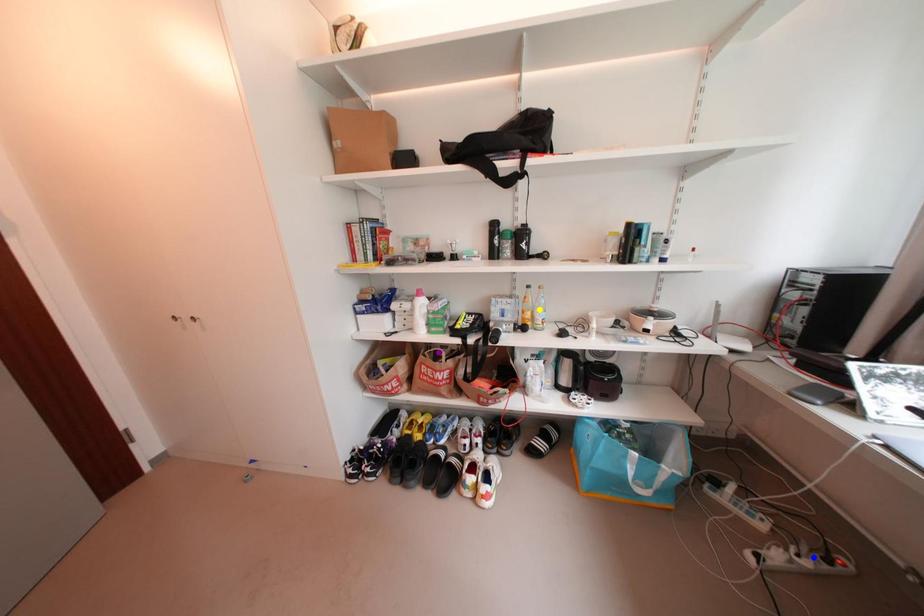
Order these from nearest to farthest:
blue point, purple point, yellow point

1. blue point
2. yellow point
3. purple point